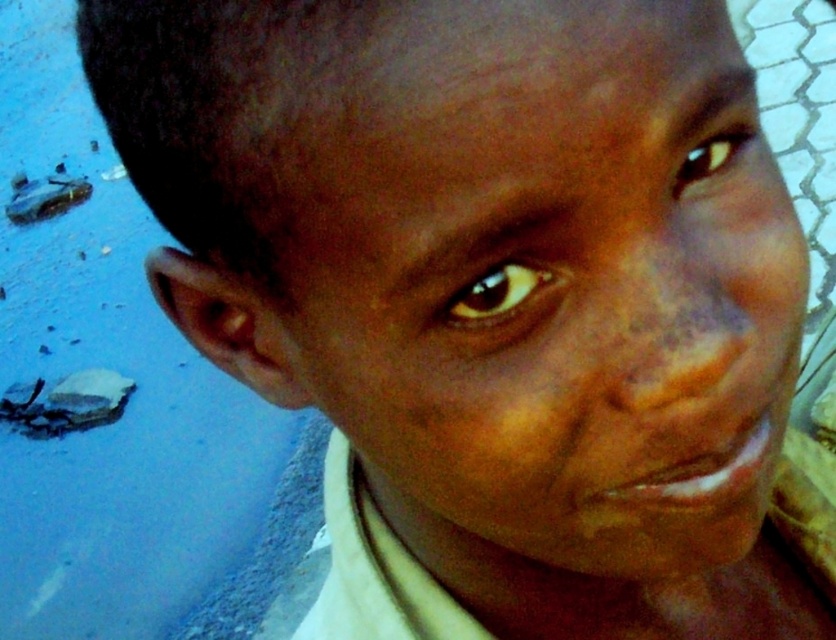
Question: Which of these objects is positioned farthest from the brown glossy eye at center?

Choices:
 (A) brown matte eye at upper right
 (B) smooth skin face at center

Answer: (B)

Question: Where is brown glossy eye at center located in relation to brown matte eye at upper right in the image?

Choices:
 (A) right
 (B) left

Answer: (B)

Question: Does smooth skin face at center appear on the right side of brown matte eye at upper right?

Choices:
 (A) yes
 (B) no

Answer: (B)

Question: Which point is closer to the camera?

Choices:
 (A) smooth skin face at center
 (B) brown glossy eye at center

Answer: (A)

Question: Does smooth skin face at center have a smaller size compared to brown glossy eye at center?

Choices:
 (A) no
 (B) yes

Answer: (A)

Question: Which object is closer to the camera taking this photo?

Choices:
 (A) smooth skin face at center
 (B) brown matte eye at upper right

Answer: (A)